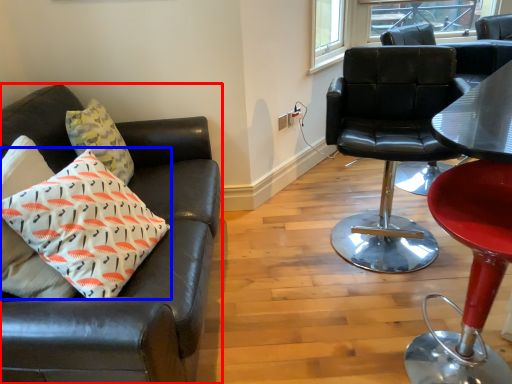
Question: Which object is further to the camera taking this photo, chair (highlighted by a red box) or pillow (highlighted by a blue box)?

Choices:
 (A) chair
 (B) pillow

Answer: (B)